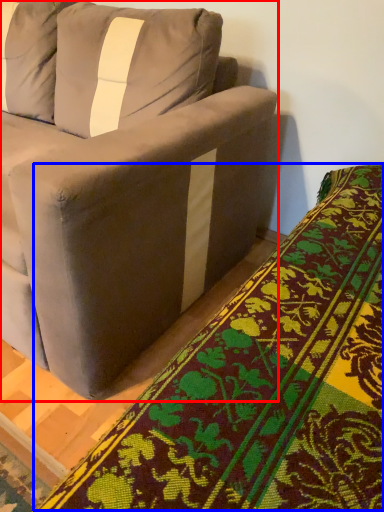
Question: Which of the following is the farthest to the observer, studio couch (highlighted by a red box) or blanket (highlighted by a blue box)?

Choices:
 (A) studio couch
 (B) blanket

Answer: (A)